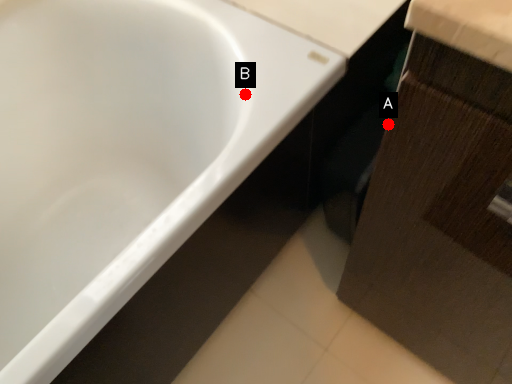
Question: Two points are circled on the image, labeled by A and B beside each circle. Among these points, which one is farthest from the camera?

Choices:
 (A) A is further
 (B) B is further

Answer: (B)